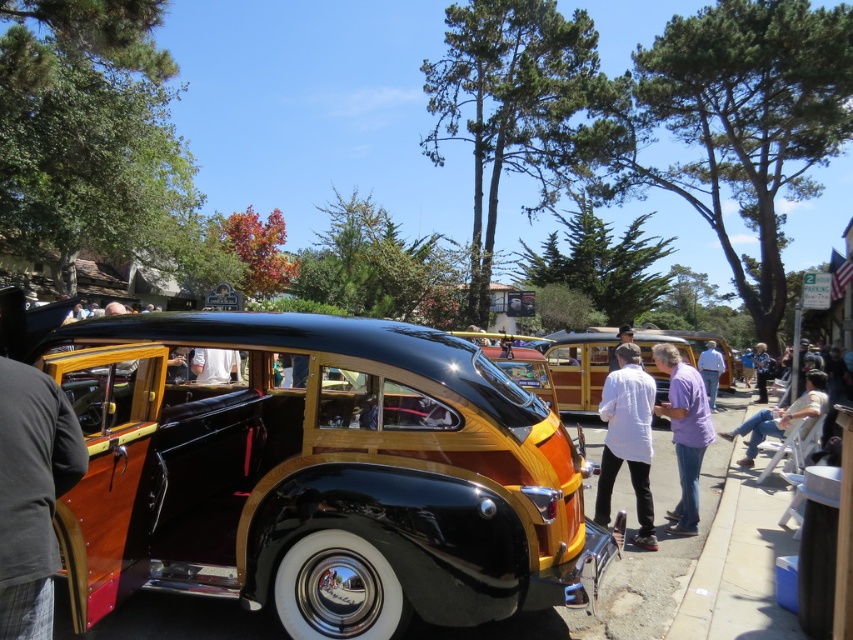
Question: Which of the following is the farthest from the observer?

Choices:
 (A) (717, 381)
 (B) (7, 388)
 (C) (392, 593)
 (D) (654, 360)

Answer: (A)

Question: Which point is closer to the camera taking this photo?

Choices:
 (A) (100, 371)
 (B) (724, 362)
 (C) (10, 458)
 (D) (804, 412)

Answer: (C)

Question: From the image, what is the correct spatial relationship of wooden paneling car at center in relation to light beige fabric chair at right?

Choices:
 (A) right
 (B) left

Answer: (B)

Question: Which point is farther from the camera taking this photo?

Choices:
 (A) (45, 436)
 (B) (670, 531)
 (C) (810, 412)
 (D) (637, 362)

Answer: (C)

Question: Can you confirm if purple cotton shirt at center is positioned below purple shirt at right?

Choices:
 (A) no
 (B) yes

Answer: (A)

Question: Is purple cotton shirt at center smaller than purple shirt at right?

Choices:
 (A) yes
 (B) no

Answer: (B)